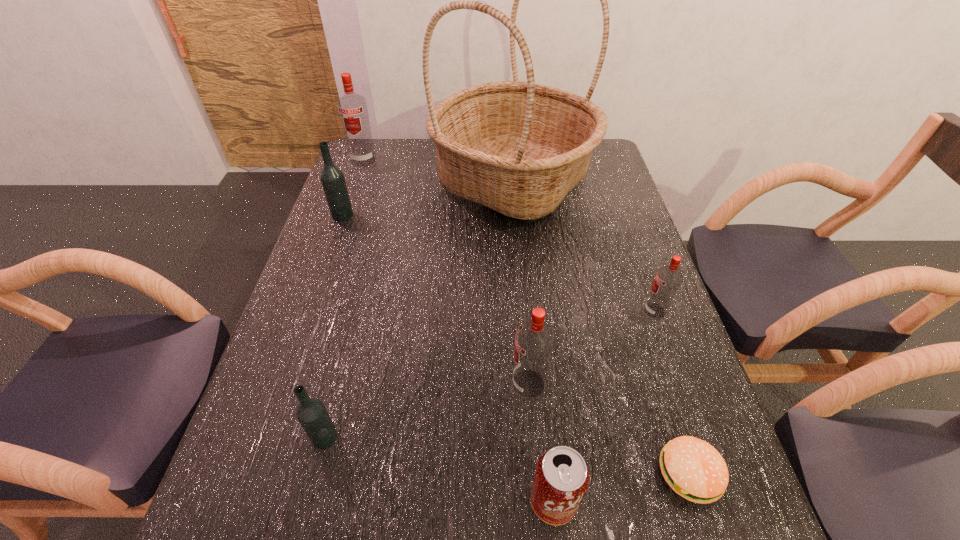
Find the location of a particular element. The image size is (960, 540). basket located in the right edge section of the desktop is located at coordinates (519, 148).

This screenshot has height=540, width=960. Find the location of `vodka that is at the right edge`. vodka that is at the right edge is located at coordinates (668, 278).

Locate an element on the screen. The width and height of the screenshot is (960, 540). patty located at the right edge is located at coordinates (693, 468).

This screenshot has height=540, width=960. I want to click on object located at the far left corner, so (x=352, y=108).

Locate an element on the screen. object located at the far right corner is located at coordinates (519, 148).

In the image, there is a desktop. At what (x,y) coordinates should I click in order to perform the action: click on vacant space at the far edge. Please return your answer as a coordinate pair (x, y). The image size is (960, 540). Looking at the image, I should click on (407, 144).

Locate an element on the screen. This screenshot has height=540, width=960. vacant space at the left edge is located at coordinates (323, 258).

Find the location of a particular element. The image size is (960, 540). free location at the right edge of the desktop is located at coordinates (612, 230).

Identify the location of free space at the far left corner of the desktop. The image size is (960, 540). (379, 165).

The width and height of the screenshot is (960, 540). In order to click on vacant space at the far right corner in this screenshot , I will do `click(613, 172)`.